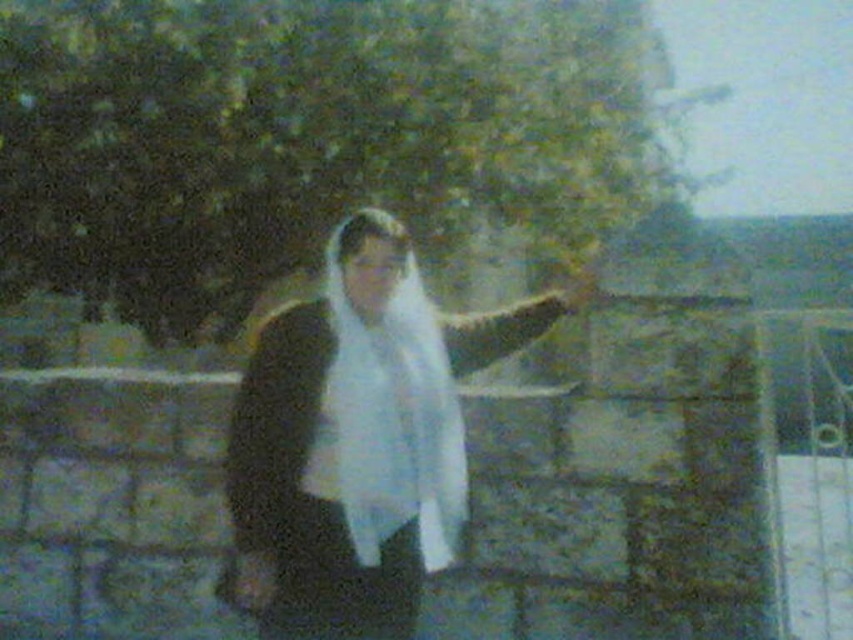
Question: Can you confirm if white matte scarf at center is smaller than white soft fabric veil at center?

Choices:
 (A) yes
 (B) no

Answer: (B)

Question: Which point is farther to the camera?

Choices:
 (A) (x=248, y=484)
 (B) (x=404, y=380)

Answer: (B)

Question: Which of the following is the farthest from the observer?

Choices:
 (A) white matte scarf at center
 (B) white soft fabric veil at center

Answer: (B)

Question: Is white matte scarf at center behind white soft fabric veil at center?

Choices:
 (A) no
 (B) yes

Answer: (A)

Question: In this image, where is white matte scarf at center located relative to white soft fabric veil at center?

Choices:
 (A) below
 (B) above

Answer: (A)

Question: Which object appears closest to the camera in this image?

Choices:
 (A) white soft fabric veil at center
 (B) white matte scarf at center

Answer: (B)